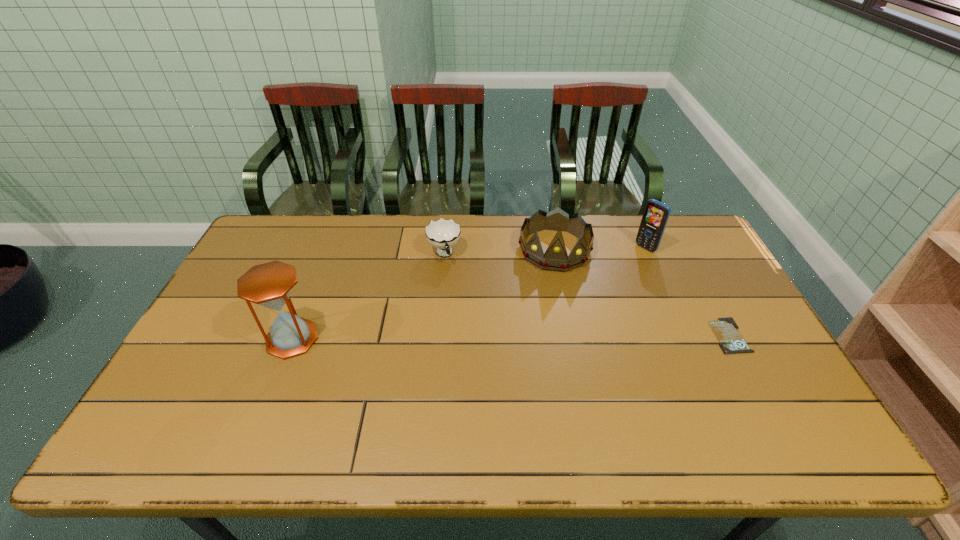
Find the location of a particular element. This screenshot has height=540, width=960. vacant spot on the desktop that is between the leftmost object and the identity card and is positioned at the front of the tiara with jewels is located at coordinates (550, 337).

The image size is (960, 540). I want to click on vacant space on the desktop that is between the tallest object and the shortest object and is positioned on the side of the fourth tallest object with the handle, so click(473, 338).

This screenshot has width=960, height=540. Find the location of `vacant space on the desktop that is between the leftmost object and the identity card and is positioned on the screen of the fourth object from left to right`. vacant space on the desktop that is between the leftmost object and the identity card and is positioned on the screen of the fourth object from left to right is located at coordinates (531, 337).